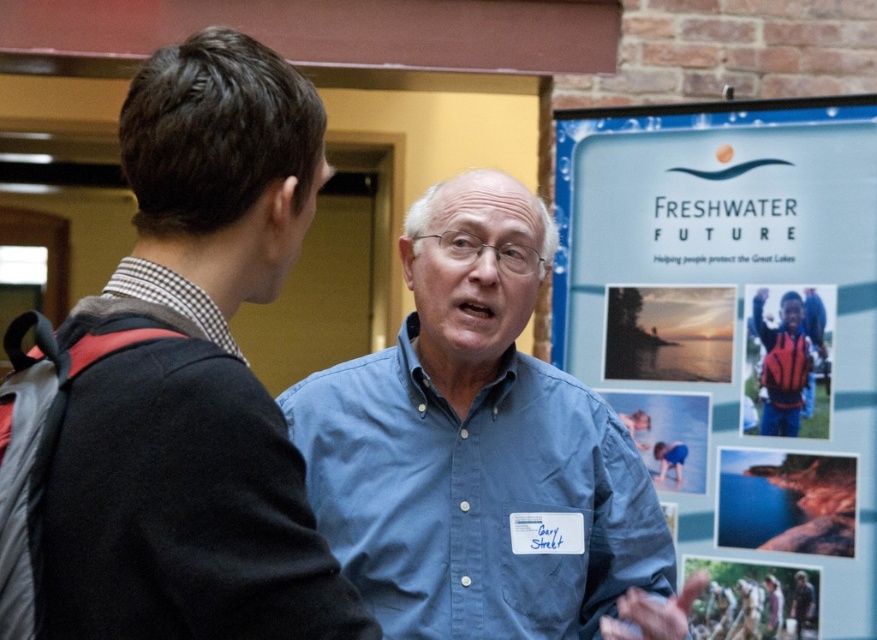
You are standing in the conference room and want to find the person with the name tag. The name tag is located at point (481, 451). Which person is wearing the blue button down shirt at center?

The person on the right wearing the blue button down shirt at center has the name tag.